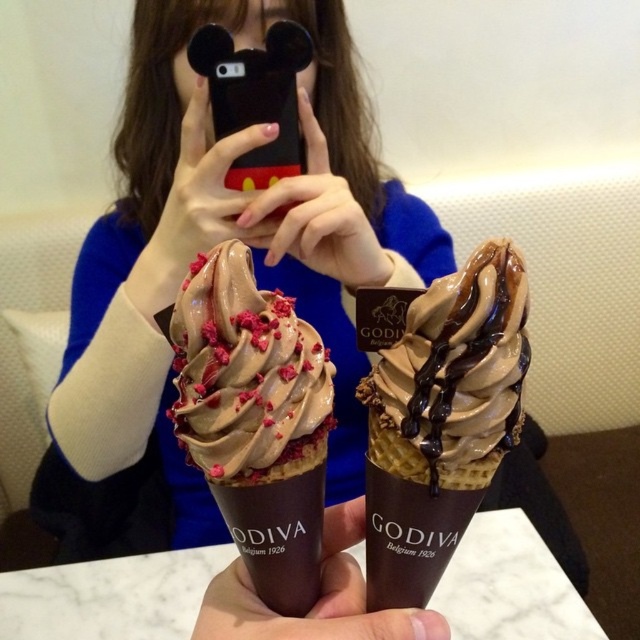
Question: Is chocolatesmoothice cream cone at center above chocolate waffle cone at center?

Choices:
 (A) yes
 (B) no

Answer: (B)

Question: Is the position of chocolatesmoothice cream cone at center more distant than that of chocolate waffle cone at center?

Choices:
 (A) yes
 (B) no

Answer: (A)

Question: Does chocolatesmoothice cream cone at center appear on the right side of chocolate waffle cone at center?

Choices:
 (A) no
 (B) yes

Answer: (A)

Question: Which point is farther from the camera taking this photo?

Choices:
 (A) (371, 397)
 (B) (275, 396)

Answer: (A)

Question: Among these objects, which one is nearest to the camera?

Choices:
 (A) chocolate waffle cone at center
 (B) chocolatesmoothice cream cone at center

Answer: (A)